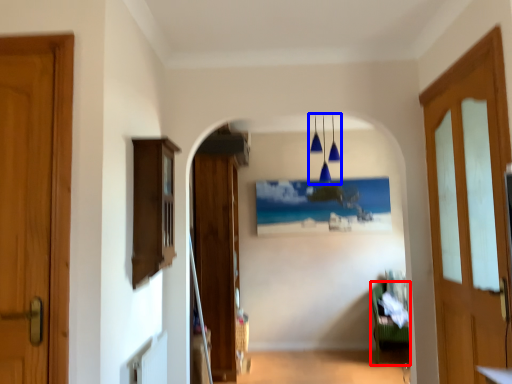
Question: Among these objects, which one is farthest to the camera, furniture (highlighted by a red box) or light fixture (highlighted by a blue box)?

Choices:
 (A) furniture
 (B) light fixture

Answer: (A)